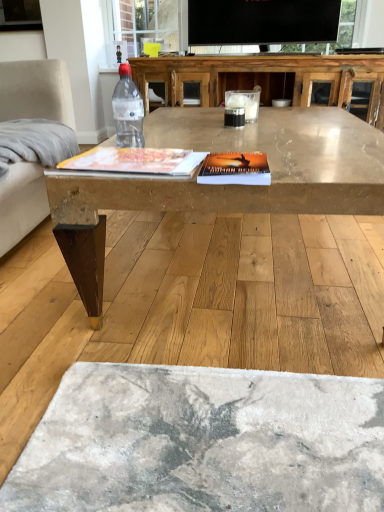
What do you see at coordinates (244, 151) in the screenshot?
I see `matte wooden coffee table at center` at bounding box center [244, 151].

In order to face clear glass table at center, should I rotate leftwards or rightwards?

To face it directly, rotate right by 8.633 degrees.

This screenshot has height=512, width=384. I want to click on transparent plastic bottle at center, so click(128, 110).

Where is `matte wooden coffee table at center`? Image resolution: width=384 pixels, height=512 pixels. matte wooden coffee table at center is located at coordinates (244, 151).

Looking at the image, does light gray fabric armchair at left seem bigger or smaller compared to transparent plastic bottle at center?

In the image, light gray fabric armchair at left appears to be larger than transparent plastic bottle at center.

Does light gray fabric armchair at left have a greater width compared to transparent plastic bottle at center?

Correct, the width of light gray fabric armchair at left exceeds that of transparent plastic bottle at center.

Based on the photo, is the depth of light gray fabric armchair at left less than that of transparent plastic bottle at center?

No, light gray fabric armchair at left is further to the viewer.

Where is `bottle on the right of the light gray fabric armchair at left`? bottle on the right of the light gray fabric armchair at left is located at coordinates pyautogui.click(x=128, y=110).

Considering the sizes of objects transparent plastic bottle at center and light gray fabric armchair at left in the image provided, who is smaller, transparent plastic bottle at center or light gray fabric armchair at left?

transparent plastic bottle at center.

Identify the location of armchair below the transparent plastic bottle at center (from a real-world perspective). The width and height of the screenshot is (384, 512). (36, 91).

How distant is transparent plastic bottle at center from light gray fabric armchair at left?

A distance of 3.67 feet exists between transparent plastic bottle at center and light gray fabric armchair at left.

From the image's perspective, which object appears higher, transparent plastic bottle at center or light gray fabric armchair at left?

transparent plastic bottle at center, from the image's perspective.

Can we say clear glass table at center lies outside transparent plastic bottle at center?

Yes, clear glass table at center is located beyond the bounds of transparent plastic bottle at center.

From the picture: Is clear glass table at center far from transparent plastic bottle at center?

No, clear glass table at center is not far from transparent plastic bottle at center.

Consider the image. Is clear glass table at center turned away from transparent plastic bottle at center?

No, clear glass table at center's orientation is not away from transparent plastic bottle at center.

Looking at this image, how far apart are clear glass table at center and matte wooden coffee table at center?

The distance of clear glass table at center from matte wooden coffee table at center is 4.50 feet.

From a real-world perspective, is clear glass table at center above or below matte wooden coffee table at center?

From a real-world perspective, clear glass table at center is physically above matte wooden coffee table at center.

Is clear glass table at center not inside matte wooden coffee table at center?

clear glass table at center is positioned outside matte wooden coffee table at center.

Which object is more forward, clear glass table at center or matte wooden coffee table at center?

matte wooden coffee table at center.

From the image's perspective, is clear glass table at center on top of light gray fabric armchair at left?

Yes, from the image's perspective, clear glass table at center is on top of light gray fabric armchair at left.

Is light gray fabric armchair at left located within clear glass table at center?

No, clear glass table at center does not contain light gray fabric armchair at left.

Based on the photo, from a real-world perspective, is light gray fabric armchair at left positioned above or below matte wooden coffee table at center?

From a real-world perspective, light gray fabric armchair at left is physically above matte wooden coffee table at center.

Does light gray fabric armchair at left have a lesser width compared to matte wooden coffee table at center?

Yes, light gray fabric armchair at left is thinner than matte wooden coffee table at center.

Is point (38, 218) positioned before point (295, 167)?

No, (38, 218) is behind (295, 167).

Is matte wooden coffee table at center far away from transparent plastic bottle at center?

Yes.

Considering the relative positions of matte wooden coffee table at center and transparent plastic bottle at center in the image provided, is matte wooden coffee table at center behind transparent plastic bottle at center?

No, matte wooden coffee table at center is closer to the camera.

Based on the photo, in terms of width, does matte wooden coffee table at center look wider or thinner when compared to transparent plastic bottle at center?

matte wooden coffee table at center is wider than transparent plastic bottle at center.

From a real-world perspective, is matte wooden coffee table at center located higher than transparent plastic bottle at center?

No.

Where is `bottle in front of the light gray fabric armchair at left`? bottle in front of the light gray fabric armchair at left is located at coordinates (128, 110).

Locate an element on the screen. bottle that appears above the light gray fabric armchair at left (from a real-world perspective) is located at coordinates (128, 110).

Considering their positions, is clear glass table at center positioned closer to light gray fabric armchair at left than matte wooden coffee table at center?

The object closer to light gray fabric armchair at left is matte wooden coffee table at center.

When comparing their distances from matte wooden coffee table at center, does transparent plastic bottle at center or light gray fabric armchair at left seem closer?

light gray fabric armchair at left lies closer to matte wooden coffee table at center than the other object.

Looking at the image, which one is located further to transparent plastic bottle at center, light gray fabric armchair at left or clear glass table at center?

light gray fabric armchair at left is positioned further to the anchor transparent plastic bottle at center.

Looking at this image, from the image, which object appears to be farther from matte wooden coffee table at center, transparent plastic bottle at center or clear glass table at center?

Based on the image, transparent plastic bottle at center appears to be further to matte wooden coffee table at center.

Based on their spatial positions, is matte wooden coffee table at center or clear glass table at center closer to transparent plastic bottle at center?

Among the two, clear glass table at center is located nearer to transparent plastic bottle at center.

When comparing their distances from matte wooden coffee table at center, does clear glass table at center or light gray fabric armchair at left seem further?

clear glass table at center is further to matte wooden coffee table at center.

Estimate the real-world distances between objects in this image. Which object is further from light gray fabric armchair at left, matte wooden coffee table at center or transparent plastic bottle at center?

transparent plastic bottle at center.

Based on their spatial positions, is matte wooden coffee table at center or light gray fabric armchair at left further from transparent plastic bottle at center?

Based on the image, matte wooden coffee table at center appears to be further to transparent plastic bottle at center.

This screenshot has width=384, height=512. I want to click on armchair located between matte wooden coffee table at center and clear glass table at center in the depth direction, so click(x=36, y=91).

The height and width of the screenshot is (512, 384). Find the location of `armchair between transparent plastic bottle at center and clear glass table at center in the front-back direction`. armchair between transparent plastic bottle at center and clear glass table at center in the front-back direction is located at coordinates point(36,91).

I want to click on bottle located between light gray fabric armchair at left and matte wooden coffee table at center in the left-right direction, so click(128, 110).

Identify the location of bottle positioned between matte wooden coffee table at center and clear glass table at center from near to far. The image size is (384, 512). (128, 110).